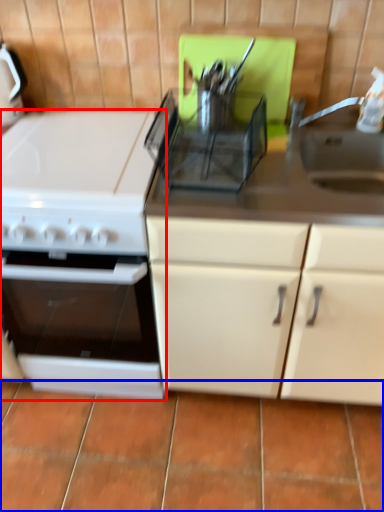
Question: Which object appears closest to the camera in this image, kitchen appliance (highlighted by a red box) or tile (highlighted by a blue box)?

Choices:
 (A) kitchen appliance
 (B) tile

Answer: (A)